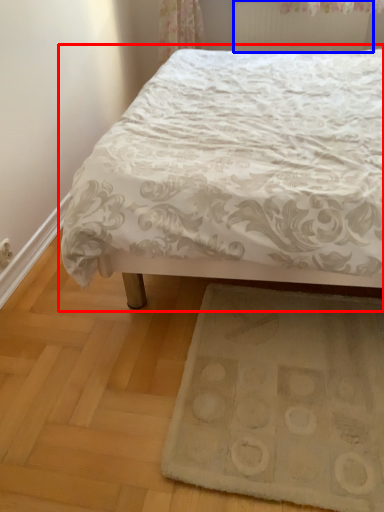
Question: Which object appears farthest to the camera in this image, bed (highlighted by a red box) or radiator (highlighted by a blue box)?

Choices:
 (A) bed
 (B) radiator

Answer: (B)